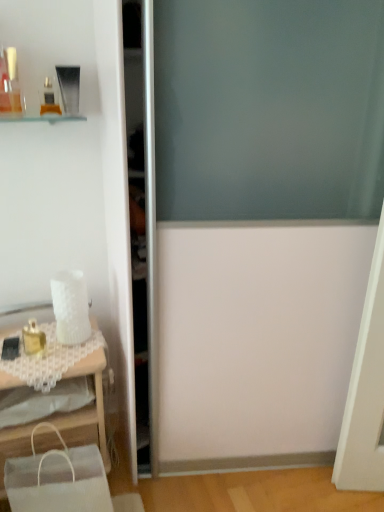
Locate an element on the screen. white fabric shopping bag at lower left is located at coordinates (58, 479).

The height and width of the screenshot is (512, 384). What do you see at coordinates (263, 217) in the screenshot? I see `transparent glass screen door at center` at bounding box center [263, 217].

This screenshot has width=384, height=512. I want to click on matte glass perfume bottle at upper left, the first toiletry from the top, so click(9, 82).

In order to click on white lace table at lower left in this screenshot , I will do `click(86, 408)`.

This screenshot has width=384, height=512. I want to click on shopping bag on the right of white lace table at lower left, so click(x=58, y=479).

Does white lace table at lower left have a lesser height compared to white fabric shopping bag at lower left?

No.

Considering the positions of objects white lace table at lower left and white fabric shopping bag at lower left in the image provided, who is in front, white lace table at lower left or white fabric shopping bag at lower left?

white fabric shopping bag at lower left is in front.

Considering the positions of objects white lace table at lower left and white fabric shopping bag at lower left in the image provided, who is more to the right, white lace table at lower left or white fabric shopping bag at lower left?

From the viewer's perspective, white fabric shopping bag at lower left appears more on the right side.

Between matte glass perfume bottle at upper left, the 3th toiletry positioned from the bottom, and transparent glass screen door at center, which one has less height?

matte glass perfume bottle at upper left, the 3th toiletry positioned from the bottom.

Would you say matte glass perfume bottle at upper left, the first toiletry from the top, contains transparent glass screen door at center?

No, transparent glass screen door at center is not inside matte glass perfume bottle at upper left, the first toiletry from the top.

Does matte glass perfume bottle at upper left, the 3th toiletry positioned from the bottom, turn towards transparent glass screen door at center?

No, matte glass perfume bottle at upper left, the 3th toiletry positioned from the bottom, does not turn towards transparent glass screen door at center.

In the image, is matte glass perfume bottle at upper left, the 3th toiletry positioned from the bottom, positioned in front of or behind transparent glass screen door at center?

In the image, matte glass perfume bottle at upper left, the 3th toiletry positioned from the bottom, appears behind transparent glass screen door at center.

From the image's perspective, is matte gold compact at upper left, which ranks as the 2th toiletry in bottom-to-top order, positioned above or below gold metallic perfume at left, marked as the third toiletry in a top-to-bottom arrangement?

Clearly, from the image's perspective, matte gold compact at upper left, which ranks as the 2th toiletry in bottom-to-top order, is above gold metallic perfume at left, marked as the third toiletry in a top-to-bottom arrangement.

Can you confirm if matte gold compact at upper left, which ranks as the 2th toiletry in bottom-to-top order, is taller than gold metallic perfume at left, which is the first toiletry from bottom to top?

No.

Is matte gold compact at upper left, which ranks as the second toiletry in top-to-bottom order, not within gold metallic perfume at left, which is the first toiletry from bottom to top?

That's correct, matte gold compact at upper left, which ranks as the second toiletry in top-to-bottom order, is outside of gold metallic perfume at left, which is the first toiletry from bottom to top.

Would you consider matte gold compact at upper left, which ranks as the second toiletry in top-to-bottom order, to be distant from gold metallic perfume at left, which is the first toiletry from bottom to top?

matte gold compact at upper left, which ranks as the second toiletry in top-to-bottom order, is actually quite close to gold metallic perfume at left, which is the first toiletry from bottom to top.

Is transparent glass screen door at center far away from matte glass perfume bottle at upper left, the 3th toiletry positioned from the bottom?

No, transparent glass screen door at center is not far away from matte glass perfume bottle at upper left, the 3th toiletry positioned from the bottom.

Measure the distance between transparent glass screen door at center and matte glass perfume bottle at upper left, the first toiletry from the top.

transparent glass screen door at center is 84.96 centimeters away from matte glass perfume bottle at upper left, the first toiletry from the top.

Is transparent glass screen door at center taller or shorter than matte glass perfume bottle at upper left, the first toiletry from the top?

Clearly, transparent glass screen door at center is taller compared to matte glass perfume bottle at upper left, the first toiletry from the top.

In the scene shown: Could you tell me if transparent glass screen door at center is facing matte glass perfume bottle at upper left, the first toiletry from the top?

No.

Is point (44, 493) less distant than point (7, 52)?

That is True.

From a real-world perspective, which object rests below the other?

In real-world perspective, white fabric shopping bag at lower left is lower.

Is white fabric shopping bag at lower left to the right of matte glass perfume bottle at upper left, the 3th toiletry positioned from the bottom, from the viewer's perspective?

Indeed, white fabric shopping bag at lower left is positioned on the right side of matte glass perfume bottle at upper left, the 3th toiletry positioned from the bottom.

How different are the orientations of white fabric shopping bag at lower left and matte glass perfume bottle at upper left, the first toiletry from the top, in degrees?

The facing directions of white fabric shopping bag at lower left and matte glass perfume bottle at upper left, the first toiletry from the top, are 10.5 degrees apart.

Is white fabric shopping bag at lower left shorter than white lace table at lower left?

Indeed, white fabric shopping bag at lower left has a lesser height compared to white lace table at lower left.

From the image's perspective, which is below, white fabric shopping bag at lower left or white lace table at lower left?

white fabric shopping bag at lower left.

Locate an element on the screen. The height and width of the screenshot is (512, 384). table to the left of white fabric shopping bag at lower left is located at coordinates (86, 408).

In the scene shown: Which object is positioned more to the left, white fabric shopping bag at lower left or white lace table at lower left?

white lace table at lower left.

Is transparent glass screen door at center positioned far away from white lace table at lower left?

That's not correct — transparent glass screen door at center is a little close to white lace table at lower left.

From a real-world perspective, is transparent glass screen door at center on top of white lace table at lower left?

Yes, from a real-world perspective, transparent glass screen door at center is over white lace table at lower left

Considering the points (195, 205) and (64, 415), which point is behind, point (195, 205) or point (64, 415)?

The point (64, 415) is farther from the camera.

How many degrees apart are the facing directions of transparent glass screen door at center and white lace table at lower left?

They differ by 0.405 degrees in their facing directions.

Identify the location of table above the white fabric shopping bag at lower left (from a real-world perspective). click(x=86, y=408).

Identify the location of screen door that is under the matte glass perfume bottle at upper left, the 3th toiletry positioned from the bottom (from a real-world perspective). (263, 217).

Considering their positions, is white lace table at lower left positioned closer to transparent glass screen door at center than white fabric shopping bag at lower left?

Among the two, white lace table at lower left is located nearer to transparent glass screen door at center.

Based on the photo, looking at the image, which one is located closer to white fabric shopping bag at lower left, gold metallic perfume at left, which is the first toiletry from bottom to top, or matte glass perfume bottle at upper left, the first toiletry from the top?

gold metallic perfume at left, which is the first toiletry from bottom to top.

When comparing their distances from transparent glass screen door at center, does gold metallic perfume at left, which is the first toiletry from bottom to top, or matte gold compact at upper left, which ranks as the 2th toiletry in bottom-to-top order, seem closer?

gold metallic perfume at left, which is the first toiletry from bottom to top, is closer to transparent glass screen door at center.

When comparing their distances from transparent glass screen door at center, does matte gold compact at upper left, which ranks as the 2th toiletry in bottom-to-top order, or matte glass perfume bottle at upper left, the first toiletry from the top, seem closer?

matte gold compact at upper left, which ranks as the 2th toiletry in bottom-to-top order, is closer to transparent glass screen door at center.

Based on their spatial positions, is white fabric shopping bag at lower left or transparent glass screen door at center closer to matte glass perfume bottle at upper left, the 3th toiletry positioned from the bottom?

transparent glass screen door at center is positioned closer to the anchor matte glass perfume bottle at upper left, the 3th toiletry positioned from the bottom.

Which object lies nearer to the anchor point matte glass perfume bottle at upper left, the first toiletry from the top, gold metallic perfume at left, which is the first toiletry from bottom to top, or white lace table at lower left?

gold metallic perfume at left, which is the first toiletry from bottom to top, is positioned closer to the anchor matte glass perfume bottle at upper left, the first toiletry from the top.

From the image, which object appears to be farther from white lace table at lower left, matte gold compact at upper left, which ranks as the second toiletry in top-to-bottom order, or white fabric shopping bag at lower left?

The object further to white lace table at lower left is matte gold compact at upper left, which ranks as the second toiletry in top-to-bottom order.

Considering their positions, is matte glass perfume bottle at upper left, the first toiletry from the top, positioned further to gold metallic perfume at left, marked as the third toiletry in a top-to-bottom arrangement, than white lace table at lower left?

The object further to gold metallic perfume at left, marked as the third toiletry in a top-to-bottom arrangement, is matte glass perfume bottle at upper left, the first toiletry from the top.

Where is `table between matte gold compact at upper left, which ranks as the second toiletry in top-to-bottom order, and white fabric shopping bag at lower left vertically`? table between matte gold compact at upper left, which ranks as the second toiletry in top-to-bottom order, and white fabric shopping bag at lower left vertically is located at coordinates (86, 408).

Find the location of a particular element. This screenshot has width=384, height=512. shopping bag between white lace table at lower left and transparent glass screen door at center in the horizontal direction is located at coordinates (58, 479).

Identify the location of table between gold metallic perfume at left, marked as the third toiletry in a top-to-bottom arrangement, and white fabric shopping bag at lower left vertically. (86, 408).

Where is `shopping bag situated between gold metallic perfume at left, which is the first toiletry from bottom to top, and transparent glass screen door at center from left to right`? Image resolution: width=384 pixels, height=512 pixels. shopping bag situated between gold metallic perfume at left, which is the first toiletry from bottom to top, and transparent glass screen door at center from left to right is located at coordinates (58, 479).